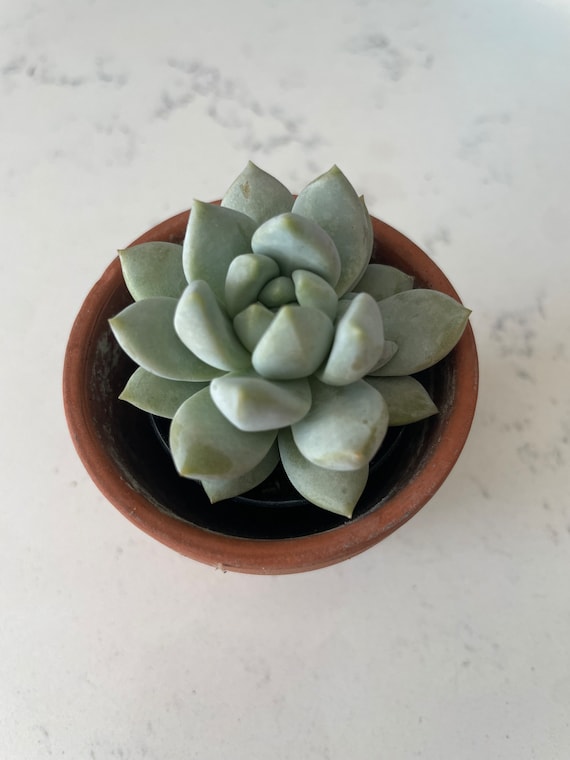
Identify the location of shadow from plant. Image resolution: width=570 pixels, height=760 pixels. (513, 444).